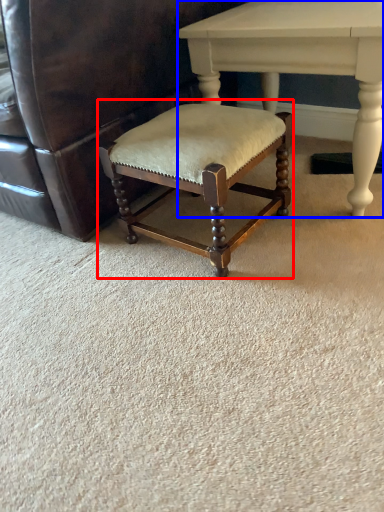
Question: Which object appears farthest to the camera in this image, bar stool (highlighted by a red box) or table (highlighted by a blue box)?

Choices:
 (A) bar stool
 (B) table

Answer: (B)